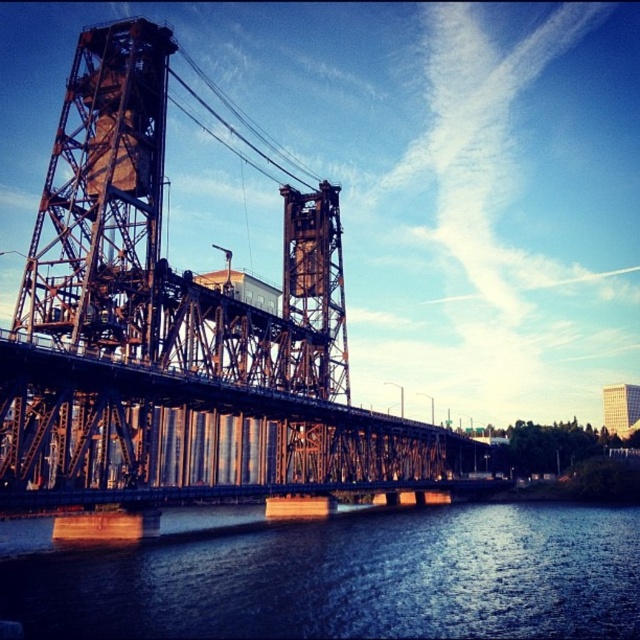
You are a drone operator who needs to fly a drone to capture a photo of the black steel bridge at center. The drone is currently at point A, which is at coordinates 0.3,0.3. To reach the bridge, the drone must fly either north or south. Which direction should the drone move to reach the bridge?

The black steel bridge at center is located at coordinates (180,336). Since the drone is at (192,192), it needs to move south to decrease its y coordinate from 0.3 to 0.284 to reach the bridge.

You are a drone operator who needs to fly a drone from the metallic wire at upper center to the dark blue water at center. What is the approximate distance you need to cover?

The dark blue water at center is 81.48 meters from the metallic wire at upper center, so the drone needs to cover approximately 81.48 meters to reach the dark blue water at center from the metallic wire at upper center.